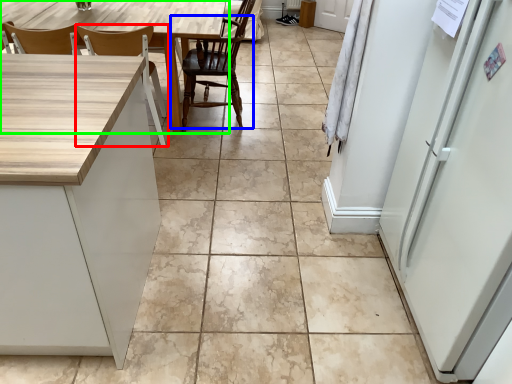
Question: Considering the real-world distances, which object is farthest from chair (highlighted by a red box)? chair (highlighted by a blue box) or table (highlighted by a green box)?

Choices:
 (A) chair
 (B) table

Answer: (A)